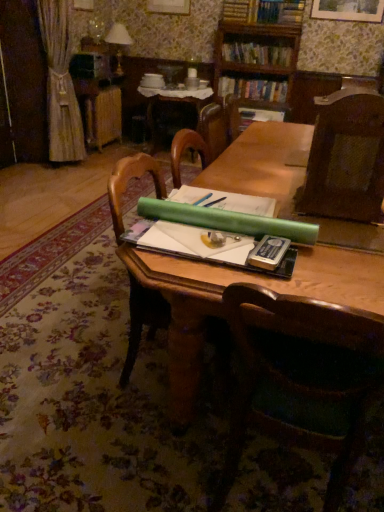
Where is `vacant space to the right of metallic silver paperback book at center`? Image resolution: width=384 pixels, height=512 pixels. vacant space to the right of metallic silver paperback book at center is located at coordinates (342, 263).